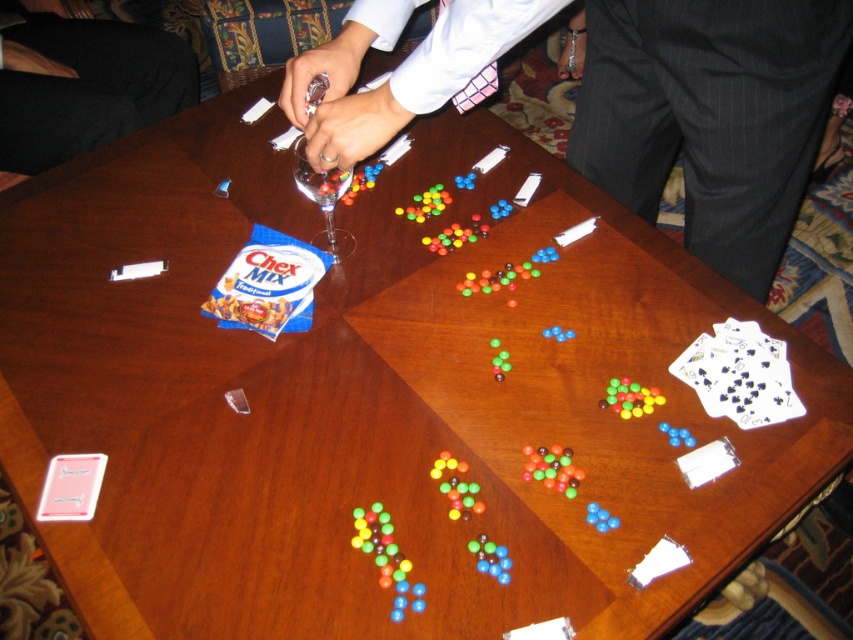
Question: Is black fabric pants at lower left thinner than pink plastic card at lower left?

Choices:
 (A) no
 (B) yes

Answer: (A)

Question: Which of the following is the farthest from the observer?

Choices:
 (A) translucent plastic beads at bottom center
 (B) white paper cards at lower right
 (C) black fabric pants at lower left

Answer: (C)

Question: Does black fabric pants at lower left appear over white paper cards at lower right?

Choices:
 (A) yes
 (B) no

Answer: (A)

Question: Considering the real-world distances, which object is closest to the white paper cards at lower right?

Choices:
 (A) white shirt at center
 (B) shiny plastic beads at center

Answer: (B)

Question: Considering the real-world distances, which object is farthest from the white paper cards at lower right?

Choices:
 (A) shiny plastic beads at center
 (B) translucent plastic beads at bottom center
 (C) white shirt at center
 (D) black fabric pants at lower left

Answer: (D)

Question: Can you confirm if white shirt at center is positioned to the left of shiny plastic beads at center?

Choices:
 (A) no
 (B) yes

Answer: (A)